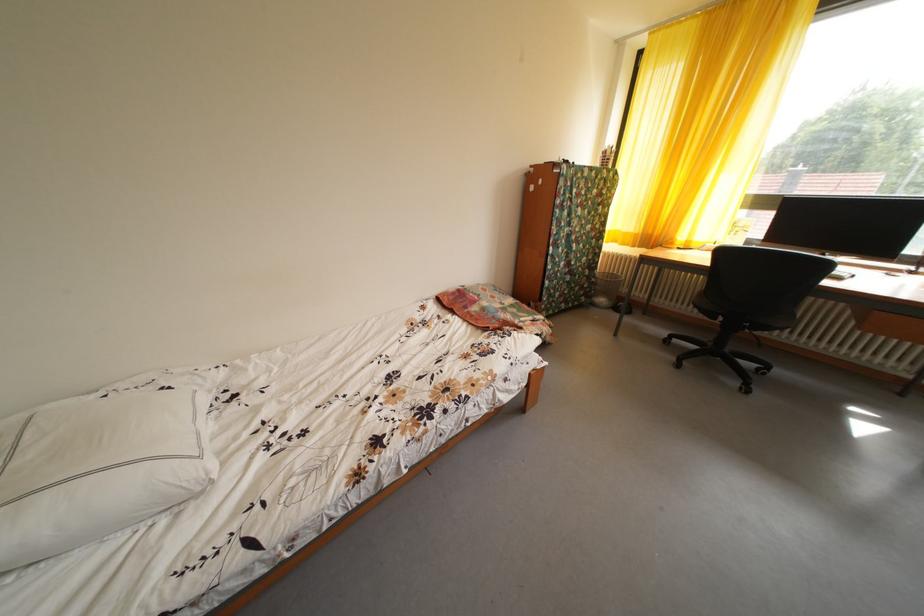
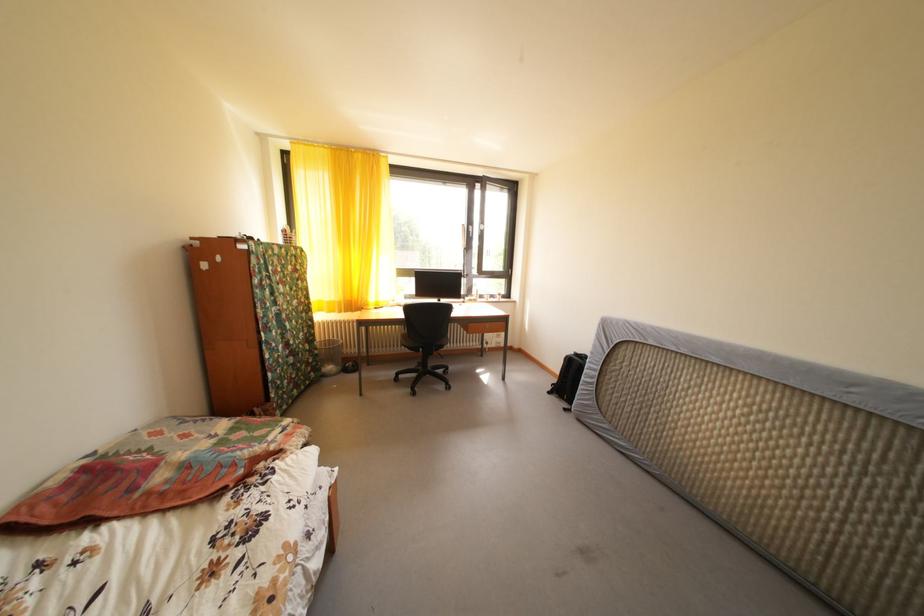
Question: Based on the continuous images, in which direction is the camera rotating? Reply with the corresponding letter.

Choices:
 (A) Left
 (B) Right
 (C) Up
 (D) Down

Answer: (B)